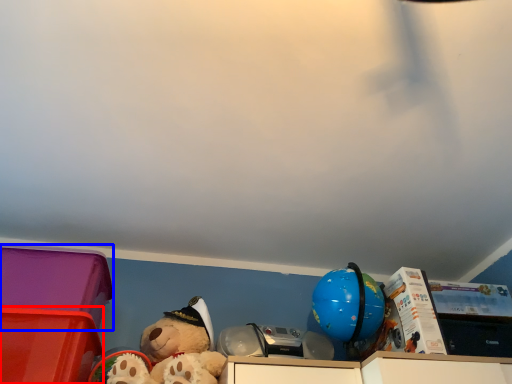
Question: Which object appears farthest to the camera in this image, storage box (highlighted by a red box) or storage box (highlighted by a blue box)?

Choices:
 (A) storage box
 (B) storage box

Answer: (B)